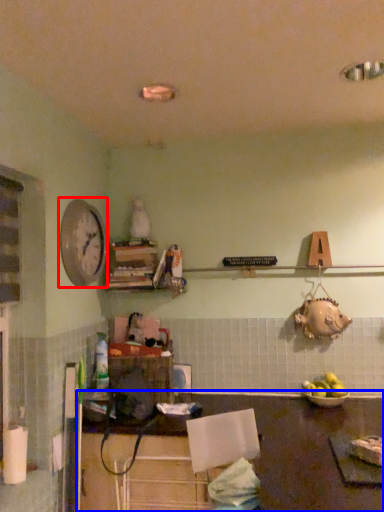
Question: Which object appears farthest to the camera in this image, clock (highlighted by a red box) or table (highlighted by a blue box)?

Choices:
 (A) clock
 (B) table

Answer: (A)